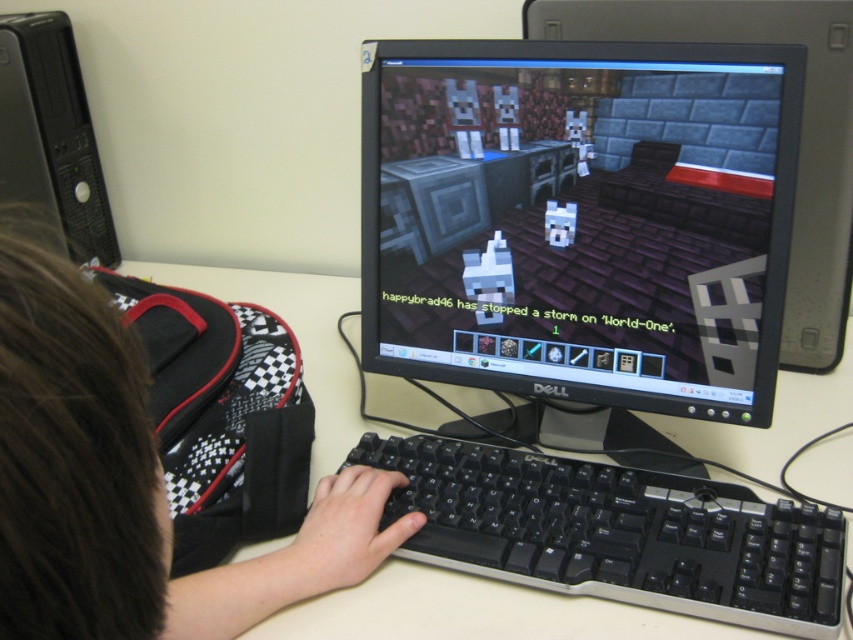
Question: Can you confirm if black matte monitor at center is wider than black plastic keyboard at center?

Choices:
 (A) no
 (B) yes

Answer: (A)

Question: Does black plastic keyboard at center have a greater width compared to white plastic computer desk at center?

Choices:
 (A) no
 (B) yes

Answer: (A)

Question: Which object is positioned closest to the black matte monitor at center?

Choices:
 (A) brown hair at upper left
 (B) white plastic computer desk at center
 (C) black glossy monitor at center
 (D) black plastic keyboard at center

Answer: (D)

Question: Which of the following is the farthest from the observer?

Choices:
 (A) brown hair at upper left
 (B) black plastic tower at left
 (C) white plastic computer desk at center

Answer: (B)

Question: Is black matte monitor at center closer to the viewer compared to white plastic computer desk at center?

Choices:
 (A) yes
 (B) no

Answer: (B)

Question: Which object appears farthest from the camera in this image?

Choices:
 (A) black matte monitor at center
 (B) black plastic keyboard at center

Answer: (A)